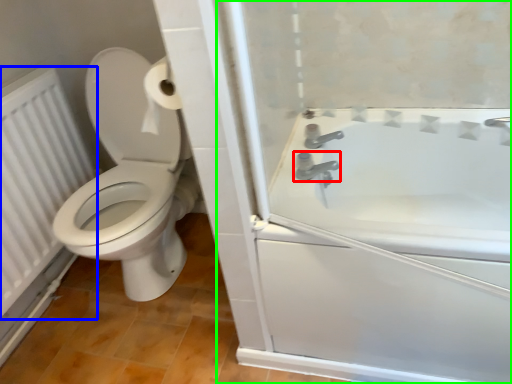
Question: Considering the real-world distances, which object is farthest from tap (highlighted by a red box)? radiator (highlighted by a blue box) or screen door (highlighted by a green box)?

Choices:
 (A) radiator
 (B) screen door

Answer: (A)